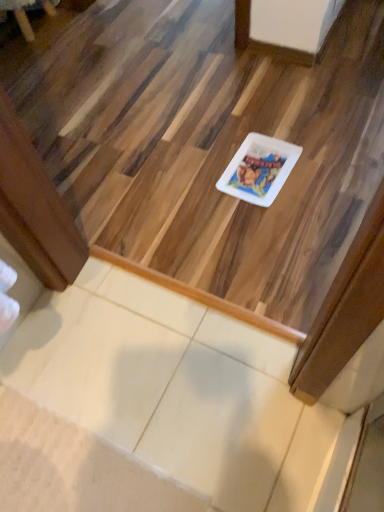
The width and height of the screenshot is (384, 512). Identify the location of vacant space in between brushed metal table at upper left and white glossy plate at center. (166, 110).